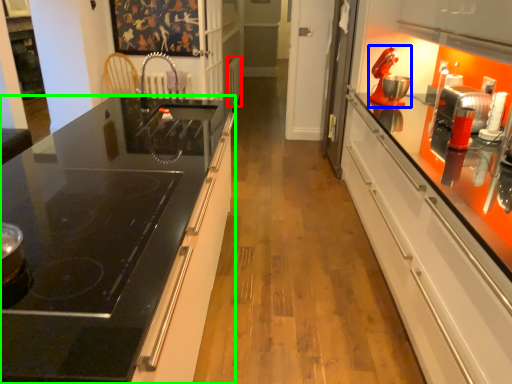
Question: Based on their relative distances, which object is farther from appliance (highlighted by a red box)? Choose from home appliance (highlighted by a blue box) and countertop (highlighted by a green box).

Choices:
 (A) home appliance
 (B) countertop

Answer: (B)